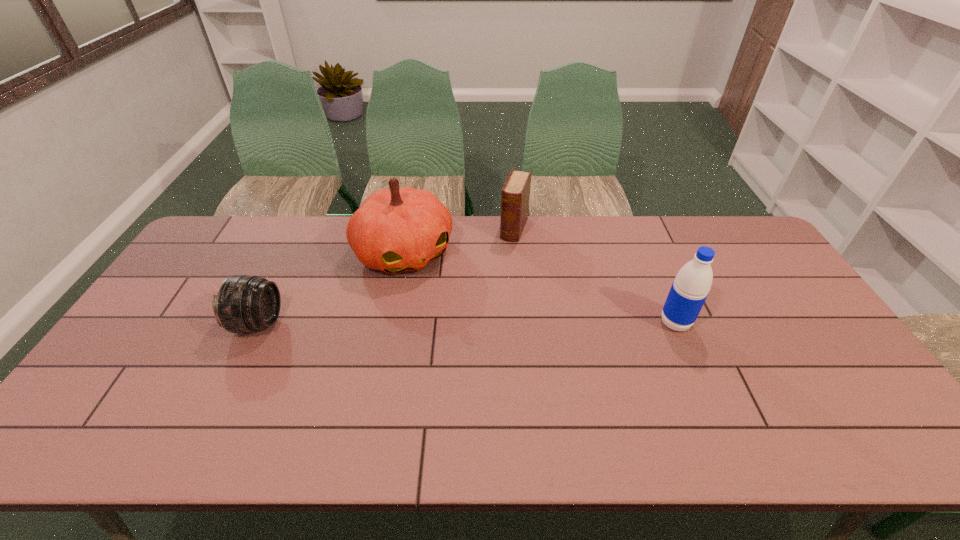
Where is `vacant area that lies between the pumpkin and the third object from left to right`? vacant area that lies between the pumpkin and the third object from left to right is located at coordinates (459, 241).

The image size is (960, 540). Identify the location of free area in between the pumpkin and the telephoto lens. (331, 288).

Locate which object is the closest to the diary. Please provide its 2D coordinates. Your answer should be formatted as a tuple, i.e. [(x, y)], where the tuple contains the x and y coordinates of a point satisfying the conditions above.

[(395, 230)]

You are a GUI agent. You are given a task and a screenshot of the screen. Output one action in this format:
    pyautogui.click(x=<x>, y=<y>)
    Task: Click on the object that is the second nearest to the water bottle
    The image size is (960, 540).
    Given the screenshot: What is the action you would take?
    pyautogui.click(x=395, y=230)

The height and width of the screenshot is (540, 960). In order to click on free location that satisfies the following two spatial constraints: 1. on the back side of the diary; 2. on the right side of the pumpkin in this screenshot , I will do click(x=409, y=228).